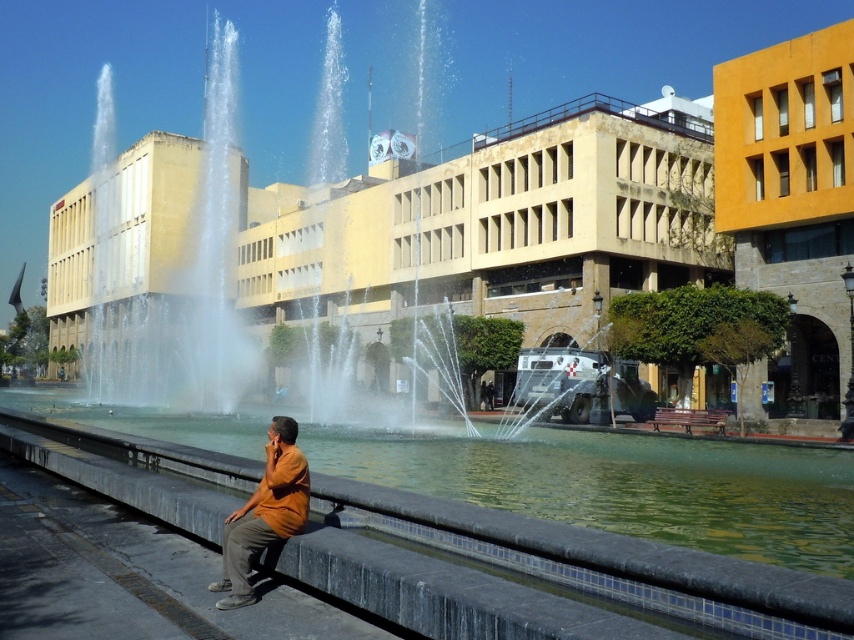
You are a delivery person carrying a box that is 2 meters long. You need to place it on the smooth concrete ledge at lower center without it overlapping the orange cotton shirt at lower center. Is there enough space between them?

The distance between the smooth concrete ledge at lower center and the orange cotton shirt at lower center is 3.65 meters. Since the box is 2 meters long, there is sufficient space to place it on the ledge without overlapping the shirt.

You are a photographer aiming to capture the orange cotton shirt at lower center and the smooth concrete ledge at lower center in a single frame. Given that your camera has a limited focus range, which object should you prioritize focusing on to ensure it appears clearer in the photo?

The smooth concrete ledge at lower center is bigger than the orange cotton shirt at lower center. Since larger objects can be more clearly captured within a limited focus range, prioritize focusing on the smooth concrete ledge at lower center.